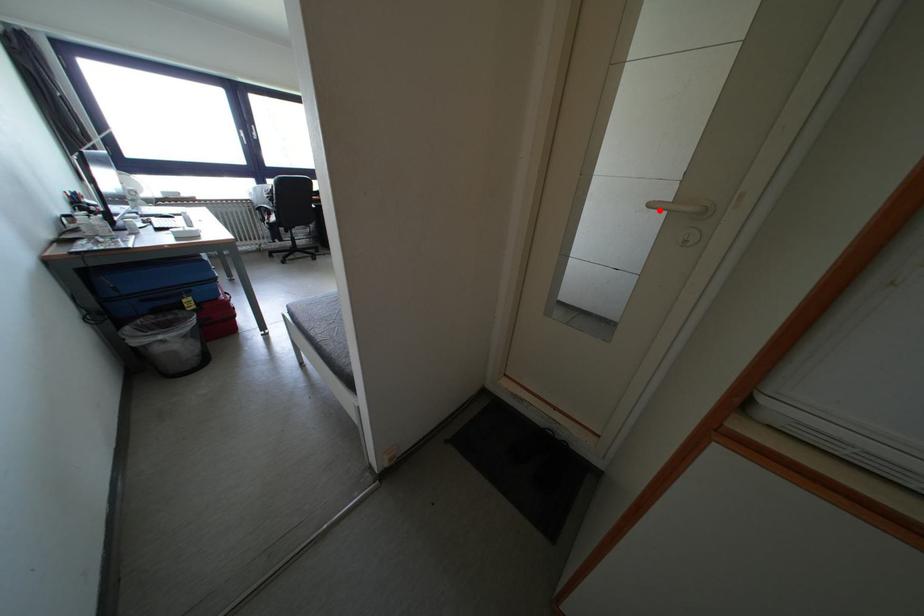
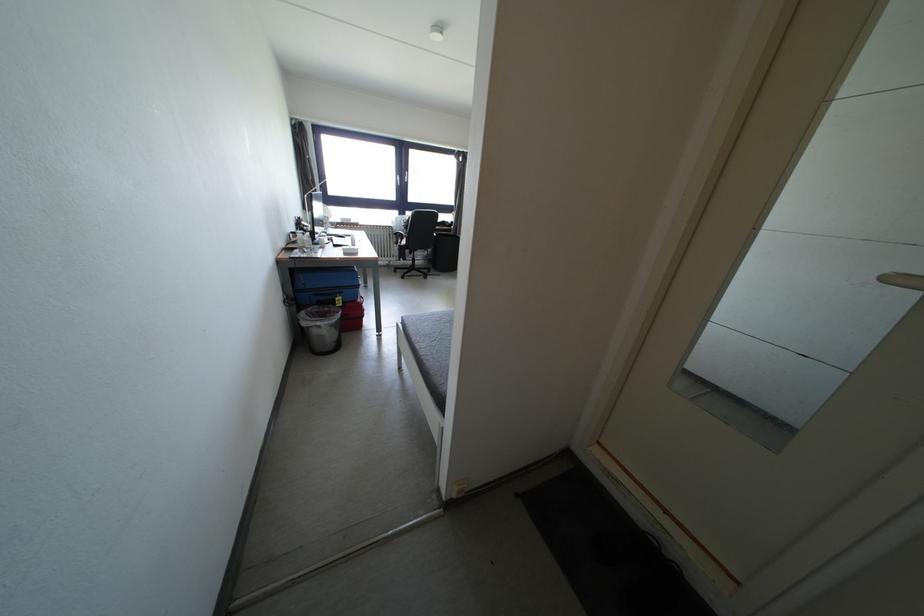
Where in the second image is the point corresponding to the highlighted location from the first image?

(898, 284)